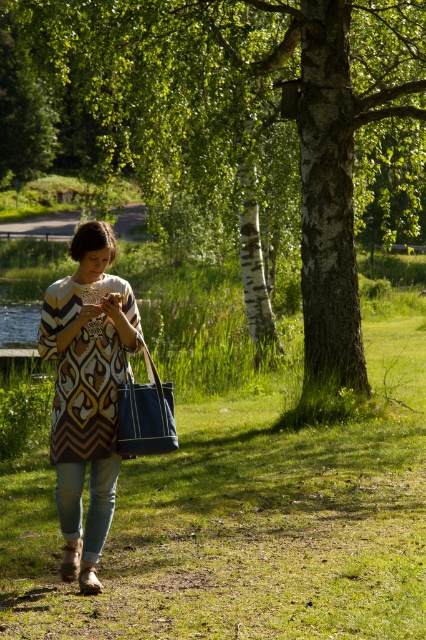
Does green bark tree at center have a smaller size compared to smooth white bark at center?

No, green bark tree at center is not smaller than smooth white bark at center.

Is point (262, 76) farther from viewer compared to point (305, 282)?

That is True.

Locate an element on the screen. The image size is (426, 640). green bark tree at center is located at coordinates (238, 129).

Between point (417, 58) and point (120, 392), which one is positioned behind?

Point (417, 58)

Can you confirm if green bark tree at center is positioned to the left of denim fabric handbag at lower center?

Indeed, green bark tree at center is positioned on the left side of denim fabric handbag at lower center.

Who is more forward, (345,102) or (126,392)?

Point (126,392) is more forward.

Where is `green bark tree at center`? This screenshot has height=640, width=426. green bark tree at center is located at coordinates (238, 129).

Does green bark tree at center come behind patterned fabric dress at center?

That is True.

Does point (411, 8) come closer to viewer compared to point (77, 250)?

No, (411, 8) is further to viewer.

Is point (34, 76) behind point (106, 321)?

That is True.

Find the location of `green bark tree at center`. green bark tree at center is located at coordinates (238, 129).